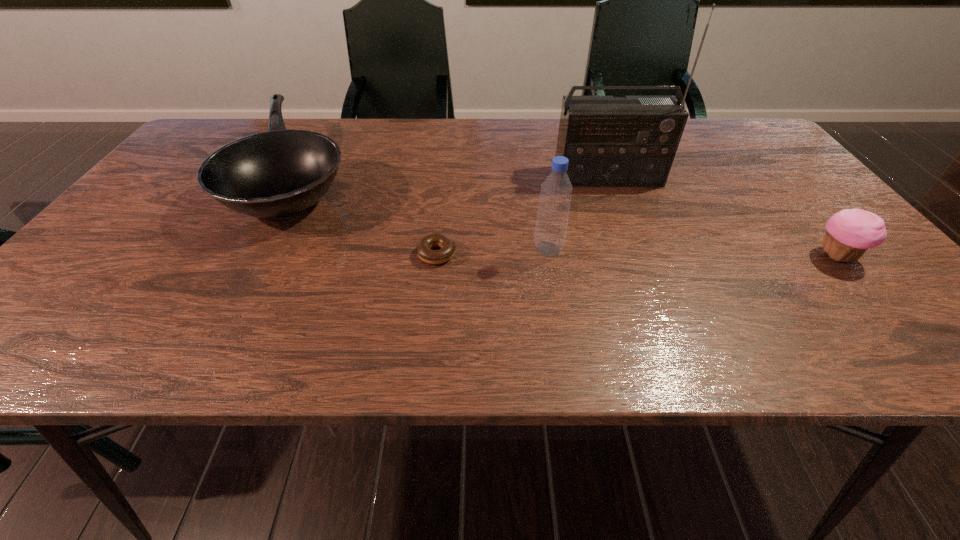
Where is `vacant area situated 0.210m on the right of the frying pan`? This screenshot has width=960, height=540. vacant area situated 0.210m on the right of the frying pan is located at coordinates (438, 178).

Where is `blank space located on the left of the rightmost object`? blank space located on the left of the rightmost object is located at coordinates (625, 256).

This screenshot has width=960, height=540. Identify the location of vacant space located 0.390m on the back of the shortest object. point(447,152).

The height and width of the screenshot is (540, 960). Identify the location of object that is at the far edge. (280, 173).

Where is `object situated at the right edge`? object situated at the right edge is located at coordinates (849, 233).

Where is `vacant region at the far edge of the desktop`? The image size is (960, 540). vacant region at the far edge of the desktop is located at coordinates (261, 129).

Where is `free space at the near edge of the desktop`? free space at the near edge of the desktop is located at coordinates tap(218, 330).

Locate an element on the screen. vacant space at the left edge is located at coordinates (143, 221).

The height and width of the screenshot is (540, 960). In the image, there is a desktop. Identify the location of free region at the right edge. (774, 200).

In the image, there is a desktop. Identify the location of vacant space at the far left corner. This screenshot has width=960, height=540. (229, 122).